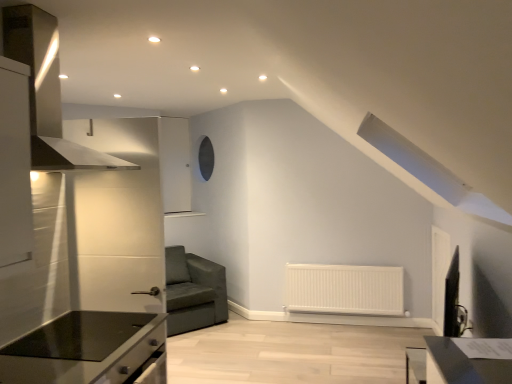
Question: Can you confirm if white matte radiator at lower center is shorter than black glass countertop at lower left?

Choices:
 (A) no
 (B) yes

Answer: (A)

Question: From the image's perspective, is white matte radiator at lower center under black glass countertop at lower left?

Choices:
 (A) yes
 (B) no

Answer: (A)

Question: Considering the relative sizes of white matte radiator at lower center and black glass countertop at lower left in the image provided, is white matte radiator at lower center smaller than black glass countertop at lower left?

Choices:
 (A) yes
 (B) no

Answer: (B)

Question: Can you see white matte radiator at lower center touching black glass countertop at lower left?

Choices:
 (A) yes
 (B) no

Answer: (B)

Question: Can you confirm if white matte radiator at lower center is positioned to the right of black glass countertop at lower left?

Choices:
 (A) no
 (B) yes

Answer: (B)

Question: Is black glass countertop at lower left taller or shorter than dark gray fabric couch at lower left?

Choices:
 (A) short
 (B) tall

Answer: (A)

Question: In terms of width, does black glass countertop at lower left look wider or thinner when compared to dark gray fabric couch at lower left?

Choices:
 (A) wide
 (B) thin

Answer: (B)

Question: Considering the relative positions of black glass countertop at lower left and dark gray fabric couch at lower left in the image provided, is black glass countertop at lower left to the left or to the right of dark gray fabric couch at lower left?

Choices:
 (A) left
 (B) right

Answer: (B)

Question: Looking at the image, does black glass countertop at lower left seem bigger or smaller compared to dark gray fabric couch at lower left?

Choices:
 (A) small
 (B) big

Answer: (A)

Question: From a real-world perspective, is dark gray fabric couch at lower left positioned above or below black glass countertop at lower left?

Choices:
 (A) above
 (B) below

Answer: (B)

Question: Which is correct: dark gray fabric couch at lower left is inside black glass countertop at lower left, or outside of it?

Choices:
 (A) inside
 (B) outside

Answer: (B)

Question: In the image, is dark gray fabric couch at lower left on the left side or the right side of black glass countertop at lower left?

Choices:
 (A) left
 (B) right

Answer: (A)

Question: Is point (167, 324) positioned closer to the camera than point (19, 342)?

Choices:
 (A) closer
 (B) farther

Answer: (B)

Question: In the image, is black glass countertop at lower left on the left side or the right side of stainless steel exhaust hood at left?

Choices:
 (A) right
 (B) left

Answer: (A)

Question: Is black glass countertop at lower left situated inside stainless steel exhaust hood at left or outside?

Choices:
 (A) outside
 (B) inside

Answer: (A)